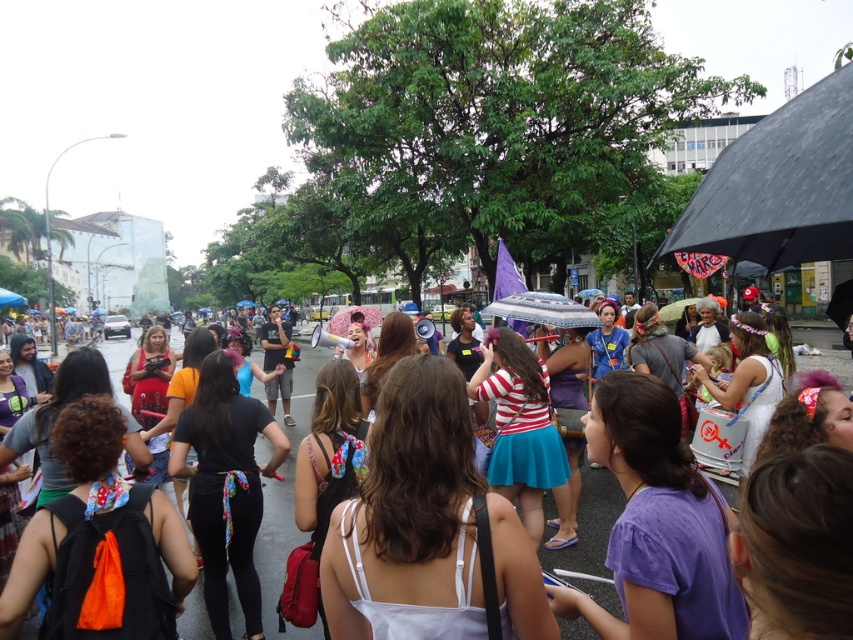
Describe the element at coordinates (426, 525) in the screenshot. I see `white fabric dress at center` at that location.

Can you confirm if white fabric dress at center is smaller than white cotton dress at center?

Correct, white fabric dress at center occupies less space than white cotton dress at center.

Which is behind, point (469, 440) or point (276, 628)?

Point (276, 628)

Identify the location of white fabric dress at center. This screenshot has height=640, width=853. (426, 525).